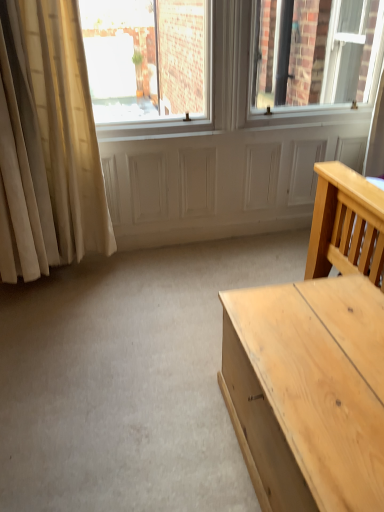
What do you see at coordinates (310, 391) in the screenshot?
I see `light wood table at lower right` at bounding box center [310, 391].

At what (x,y) coordinates should I click in order to perform the action: click on light wood table at lower right. Please return your answer as a coordinate pair (x, y). Looking at the image, I should click on (310, 391).

I want to click on light wood table at lower right, so click(310, 391).